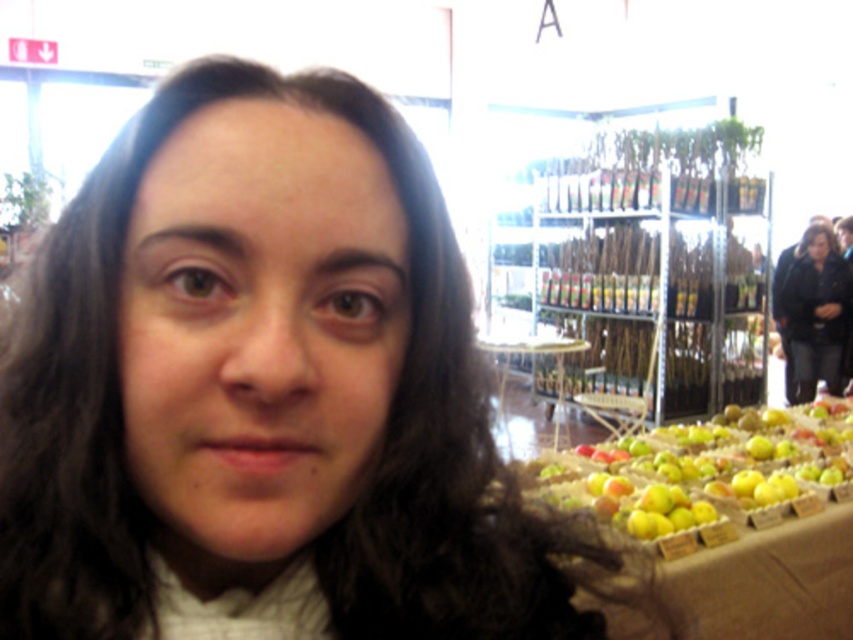
Question: Which point is farther to the camera?

Choices:
 (A) green matte apples at lower right
 (B) clear glass table at center
 (C) black leather jacket at right

Answer: (C)

Question: Which is farther from the green matte apples at lower right?

Choices:
 (A) clear glass table at center
 (B) black leather jacket at right

Answer: (B)

Question: Is black leather jacket at right bigger than clear glass table at center?

Choices:
 (A) no
 (B) yes

Answer: (A)

Question: Which point is farther from the camera taking this photo?

Choices:
 (A) (570, 346)
 (B) (820, 275)

Answer: (B)

Question: Is green matte apples at lower right further to camera compared to clear glass table at center?

Choices:
 (A) no
 (B) yes

Answer: (A)

Question: Can you confirm if green matte apples at lower right is smaller than clear glass table at center?

Choices:
 (A) yes
 (B) no

Answer: (B)